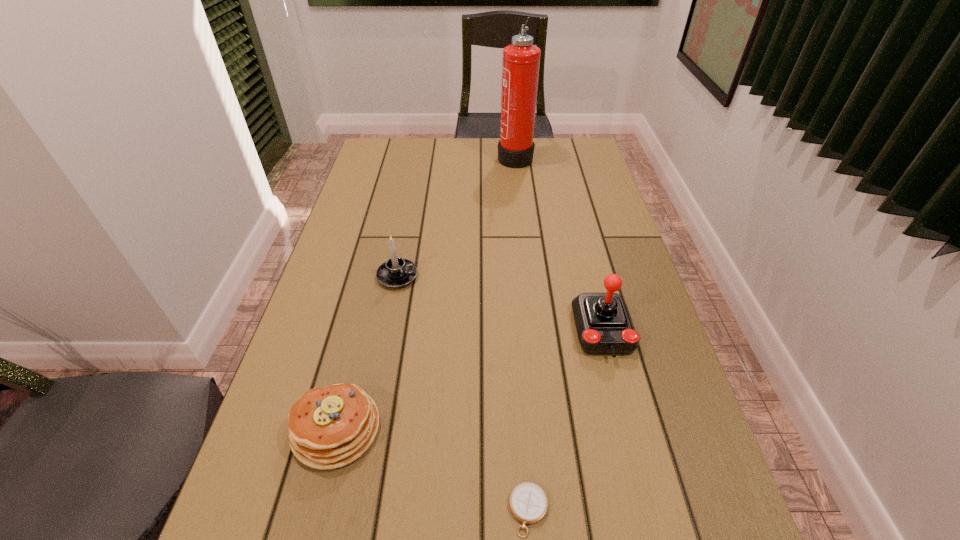
At what (x,y) coordinates should I click in order to perform the action: click on fire extinguisher. Please return your answer as a coordinate pair (x, y). Image resolution: width=960 pixels, height=540 pixels. Looking at the image, I should click on (520, 68).

Locate an element on the screen. Image resolution: width=960 pixels, height=540 pixels. the tallest object is located at coordinates (520, 68).

The width and height of the screenshot is (960, 540). In order to click on joystick in this screenshot , I will do `click(604, 326)`.

Where is `the rightmost object`? the rightmost object is located at coordinates (604, 326).

You are a GUI agent. You are given a task and a screenshot of the screen. Output one action in this format:
    pyautogui.click(x=<x>, y=<y>)
    Task: Click on the second farthest object
    Image resolution: width=960 pixels, height=540 pixels.
    Given the screenshot: What is the action you would take?
    pyautogui.click(x=396, y=272)

Find the location of a particular element. The width and height of the screenshot is (960, 540). the fourth tallest object is located at coordinates pyautogui.click(x=331, y=427).

This screenshot has width=960, height=540. In order to click on the second nearest object in this screenshot , I will do `click(331, 427)`.

Find the location of a particular element. This screenshot has width=960, height=540. compass is located at coordinates (528, 502).

You are a GUI agent. You are given a task and a screenshot of the screen. Output one action in this format:
    pyautogui.click(x=<x>, y=<y>)
    Task: Click on the shortest object
    
    Given the screenshot: What is the action you would take?
    pyautogui.click(x=528, y=502)

Where is `free point located on the front-facing side of the farthest object`? Image resolution: width=960 pixels, height=540 pixels. free point located on the front-facing side of the farthest object is located at coordinates (437, 156).